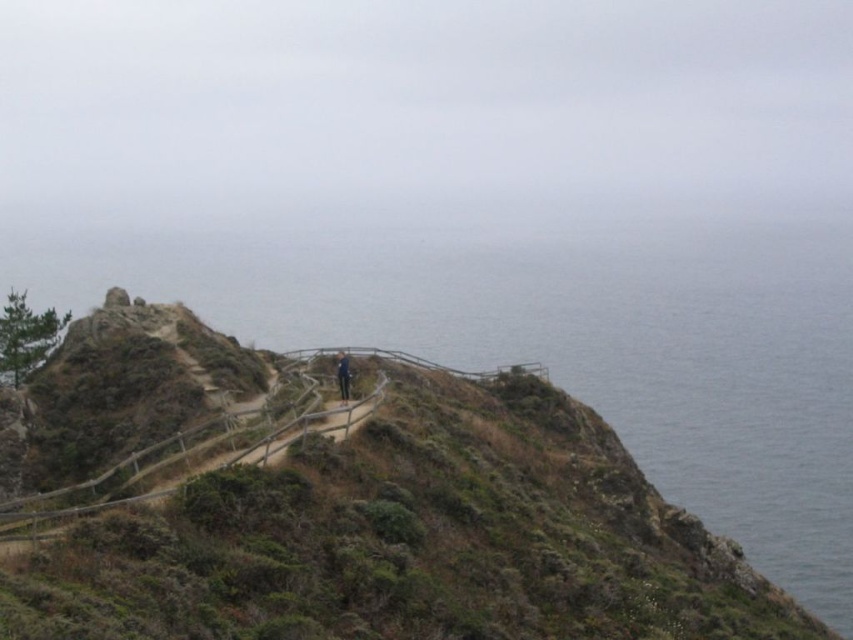
Can you confirm if gray water at upper right is positioned to the right of light brown wooden fence at upper center?

Incorrect, gray water at upper right is not on the right side of light brown wooden fence at upper center.

What do you see at coordinates (577, 349) in the screenshot? I see `gray water at upper right` at bounding box center [577, 349].

Identify the location of gray water at upper right. The width and height of the screenshot is (853, 640). (577, 349).

The image size is (853, 640). In order to click on gray water at upper right in this screenshot , I will do `click(577, 349)`.